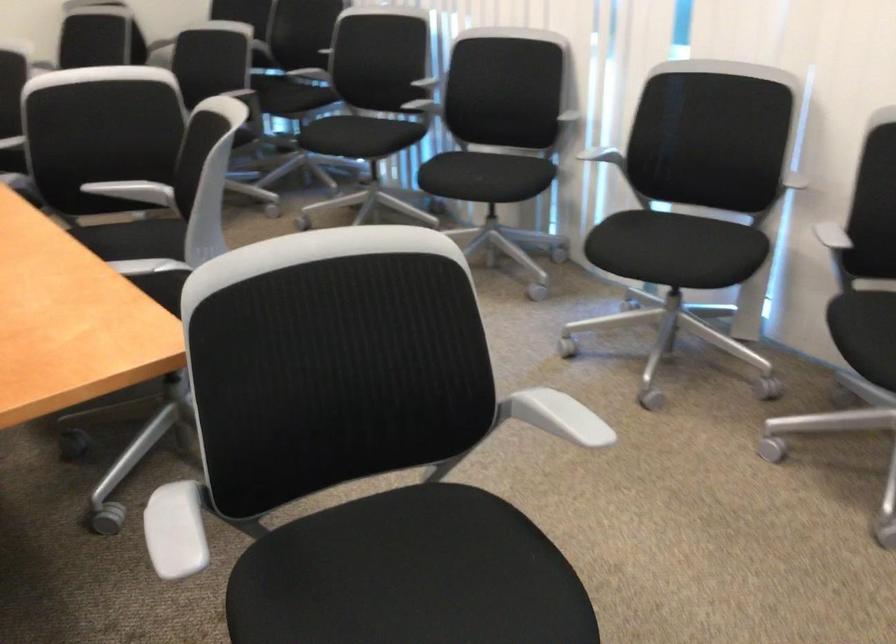
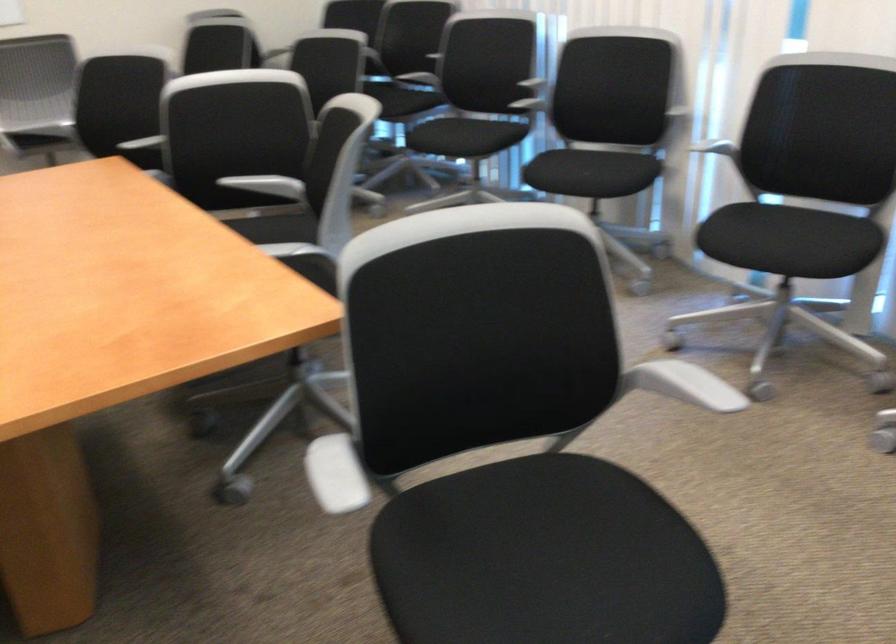
Where in the second image is the point corresponding to point 143,192 from the first image?

(268, 185)